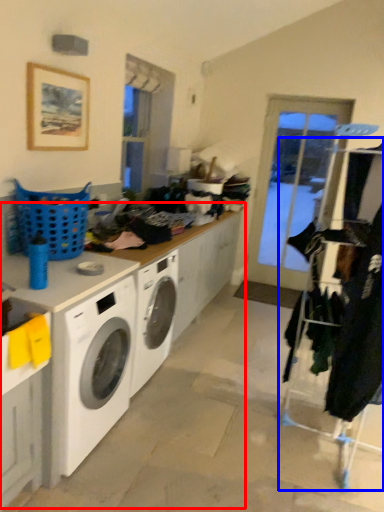
Question: Which of the following is the farthest to the observer, counter top (highlighted by a red box) or closet (highlighted by a blue box)?

Choices:
 (A) counter top
 (B) closet

Answer: (B)